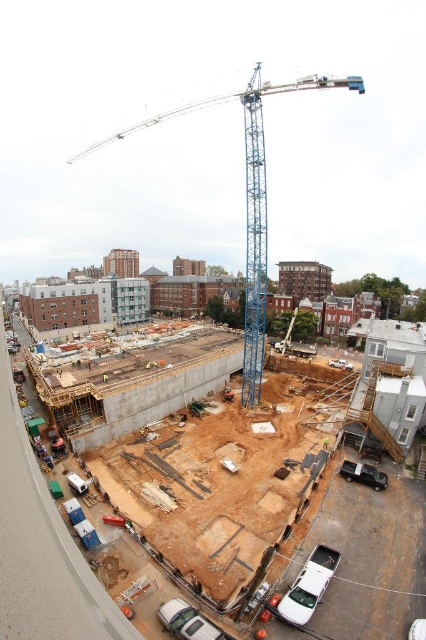
You are a construction supervisor planning to place a new safety barrier at the center of the construction site. The safety barrier requires a clear area of 2 meters in diameter. Based on the scene, is the brown concrete foundation at center located within the required clear area for the safety barrier?

The brown concrete foundation at center is located at point coordinates of [368,560]. Since the safety barrier requires a clear area of 2 meters in diameter at the center, the foundation is within the required clear area because its position is at the center coordinates.

From the picture: You are a construction supervisor planning to place a new temporary storage container on the site. Given the brown concrete foundation at center and the blue metallic crane at center, which area would you choose to place the container to ensure it doesn

The brown concrete foundation at center occupies less space than the blue metallic crane at center, so placing the container on the brown concrete foundation at center would be more feasible as it requires less area.

You are an observer standing on the balcony overlooking the construction site. You see the blue metallic crane at center and the white matte car at lower right. Which object appears bigger in the scene?

The blue metallic crane at center appears bigger than the white matte car at lower right in the scene.